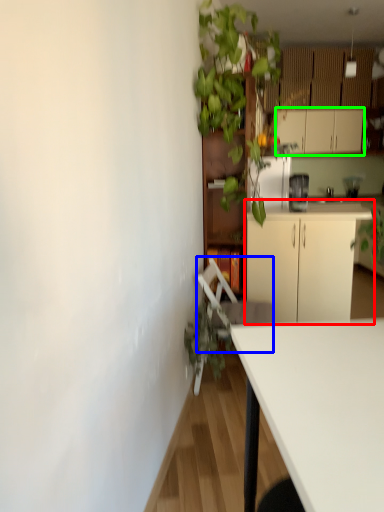
Question: Which object is the closest to the cabinetry (highlighted by a red box)? Choose among these: swivel chair (highlighted by a blue box) or cabinetry (highlighted by a green box).

Choices:
 (A) swivel chair
 (B) cabinetry

Answer: (A)